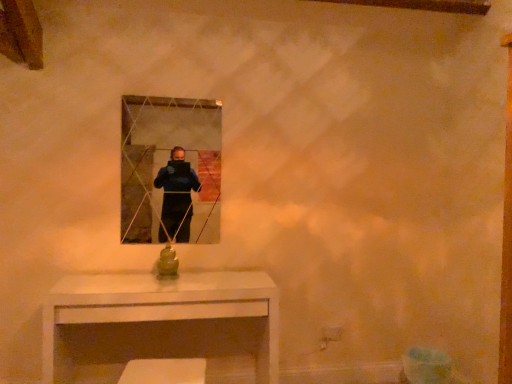
Question: Is clear glass mirror at center wider or thinner than white glossy table at lower center?

Choices:
 (A) wide
 (B) thin

Answer: (B)

Question: From a real-world perspective, is clear glass mirror at center above or below white glossy table at lower center?

Choices:
 (A) above
 (B) below

Answer: (A)

Question: Would you say clear glass mirror at center is to the left or to the right of white glossy table at lower center in the picture?

Choices:
 (A) left
 (B) right

Answer: (A)

Question: Considering the positions of white glossy table at lower center and clear glass mirror at center in the image, is white glossy table at lower center wider or thinner than clear glass mirror at center?

Choices:
 (A) wide
 (B) thin

Answer: (A)

Question: From the image's perspective, is white glossy table at lower center above or below clear glass mirror at center?

Choices:
 (A) above
 (B) below

Answer: (B)

Question: Is white glossy table at lower center bigger or smaller than clear glass mirror at center?

Choices:
 (A) small
 (B) big

Answer: (B)

Question: Considering their positions, is white glossy table at lower center located in front of or behind clear glass mirror at center?

Choices:
 (A) behind
 (B) front

Answer: (B)